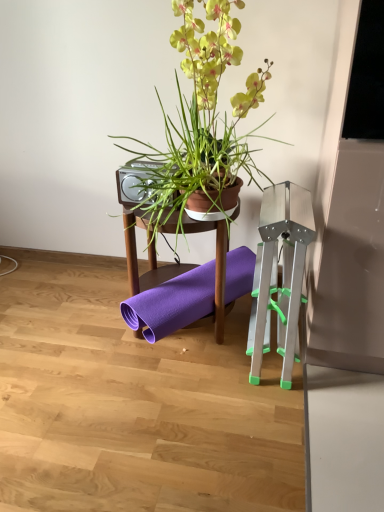
Identify the location of vacant space to the left of metallic silver easel at right. (164, 367).